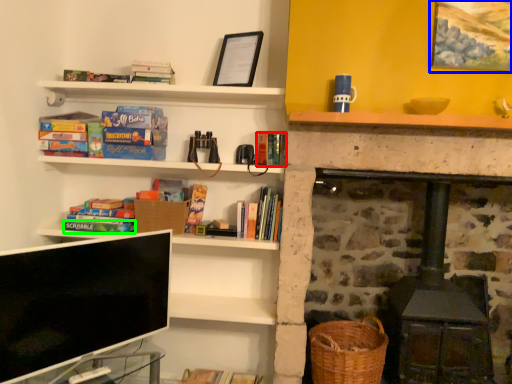
Question: Which is farther away from book (highlighted by a red box)? picture frame (highlighted by a blue box) or paperback book (highlighted by a green box)?

Choices:
 (A) picture frame
 (B) paperback book

Answer: (A)